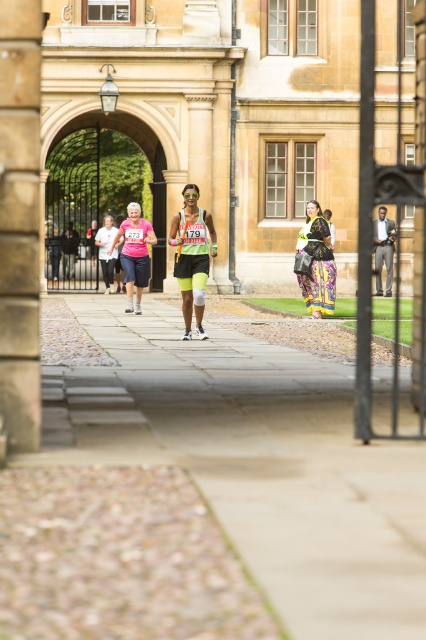
You are a photographer standing on the pathway and want to take a photo of both the matte black shorts at center and the floral fabric dress at center. Which one should you adjust to be on the left side in the photo?

The matte black shorts at center is already positioned on the left side of the floral fabric dress at center, so you don not need to adjust anything.

You are standing on the pathway and see both the matte black shorts at center and the floral fabric dress at center. Which one is nearer to you?

The matte black shorts at center is closer to the viewer than the floral fabric dress at center.

You are standing at the entrance of the historic building and notice two points marked on the pathway. The first point is at coordinate point (408, 540) and the second is at point (391, 296). Which point is nearer to your current position?

Point (408, 540) is closer to the camera than point (391, 296), so the first point is nearer to your current position.